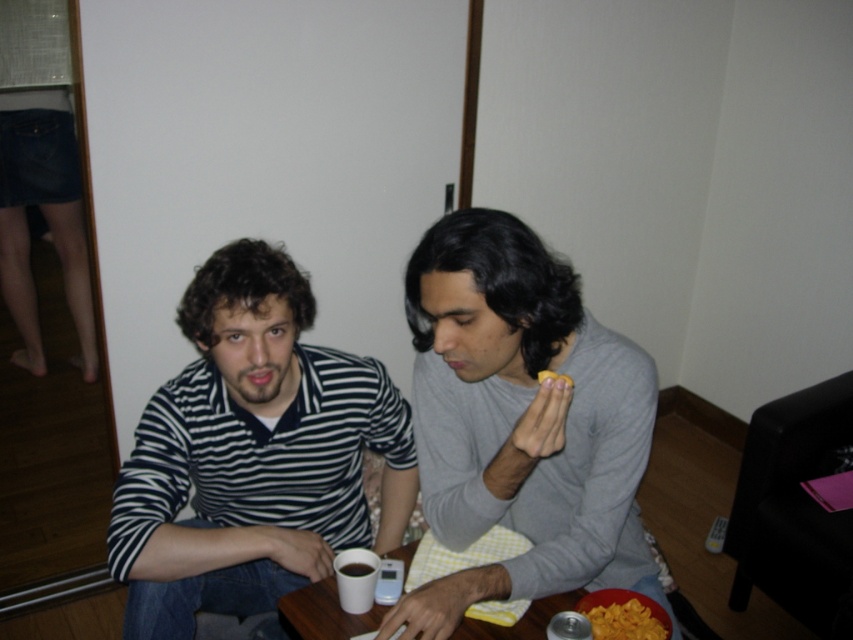
Between white glossy table at center and yellow crispy chips at lower center, which one is positioned higher?

white glossy table at center is higher up.

In order to click on white glossy table at center in this screenshot , I will do `click(323, 612)`.

What do you see at coordinates (323, 612) in the screenshot? I see `white glossy table at center` at bounding box center [323, 612].

Locate an element on the screen. The width and height of the screenshot is (853, 640). white glossy table at center is located at coordinates click(323, 612).

Is gray matte shirt at center below striped cotton shirt at center?

Correct, gray matte shirt at center is located below striped cotton shirt at center.

Is the position of gray matte shirt at center more distant than that of striped cotton shirt at center?

No, gray matte shirt at center is in front of striped cotton shirt at center.

Locate an element on the screen. gray matte shirt at center is located at coordinates [x=521, y=420].

You are a GUI agent. You are given a task and a screenshot of the screen. Output one action in this format:
    pyautogui.click(x=<x>, y=<y>)
    Task: Click on the gray matte shirt at center
    
    Given the screenshot: What is the action you would take?
    coord(521,420)

Does yellow crispy chips at lower center have a smaller size compared to white matte cup at center?

Incorrect, yellow crispy chips at lower center is not smaller in size than white matte cup at center.

Based on the photo, is yellow crispy chips at lower center taller than white matte cup at center?

No, yellow crispy chips at lower center is not taller than white matte cup at center.

Find the location of `yellow crispy chips at lower center`. yellow crispy chips at lower center is located at coordinates (624, 621).